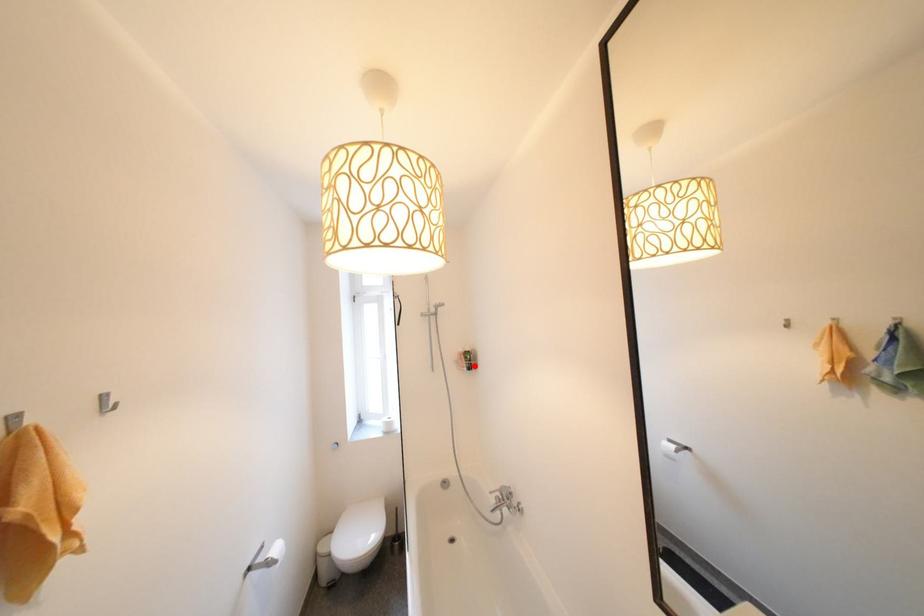
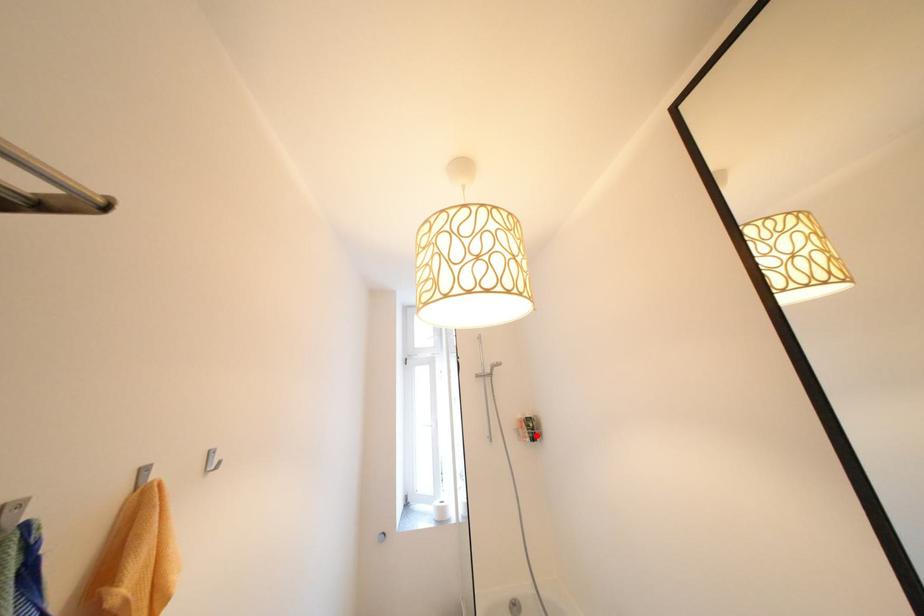
I am providing you with two images of the same scene from different viewpoints. A red point is marked on the first image and another point is marked on the second image. Is the red point in image1 aligned with the point shown in image2?

Yes